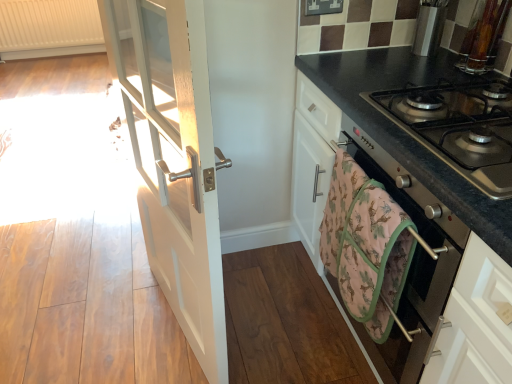
Where is `free space that is to the left of white wood door at left`? free space that is to the left of white wood door at left is located at coordinates [102, 326].